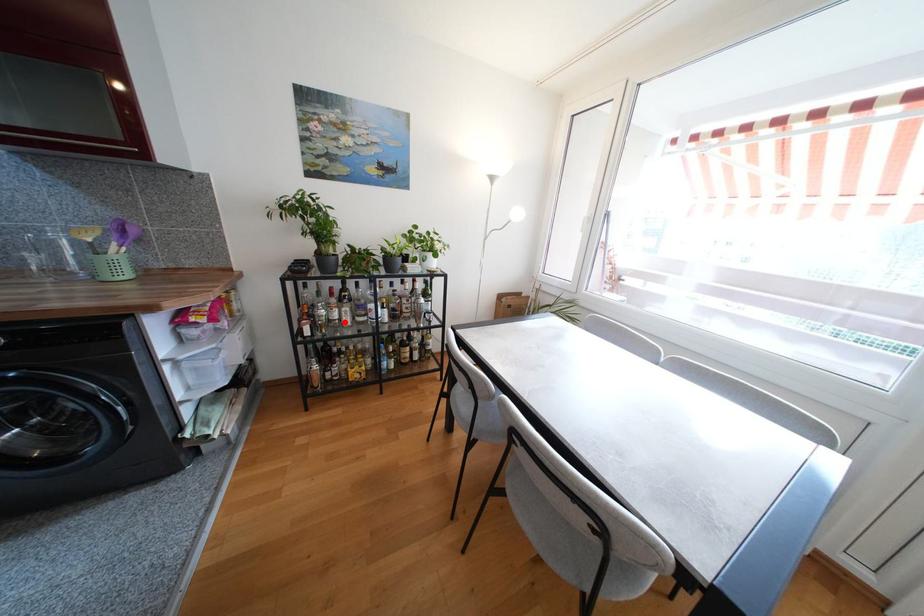
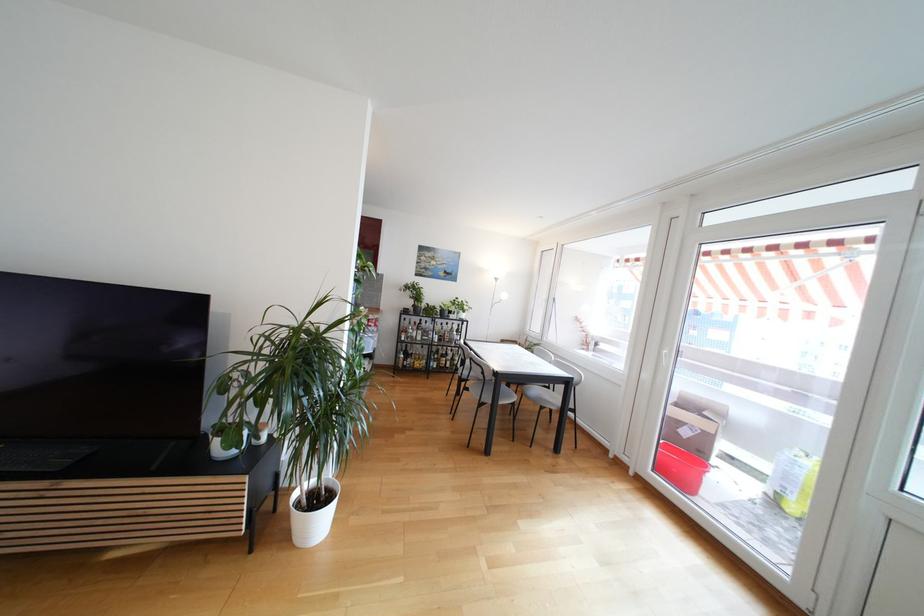
Where in the second image is the point corresponding to the highlighted location from the first image?

(419, 339)